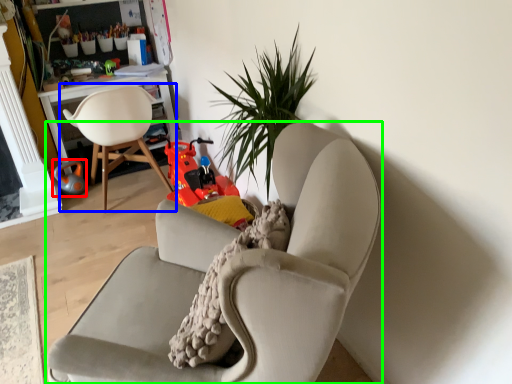
Question: Estimate the real-world distances between objects in this image. Which object is closer to toy (highlighted by a red box), chair (highlighted by a blue box) or chair (highlighted by a green box)?

Choices:
 (A) chair
 (B) chair

Answer: (A)